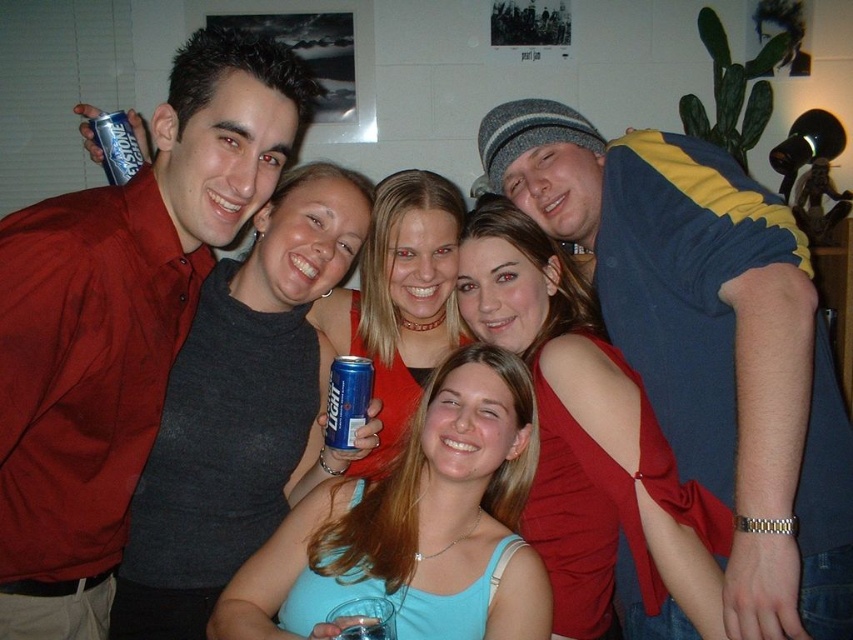
Question: Can you confirm if blue metallic can at center is smaller than blue metallic can at upper left?

Choices:
 (A) yes
 (B) no

Answer: (A)

Question: Does matte red shirt at left appear under blue metallic can at center?

Choices:
 (A) no
 (B) yes

Answer: (A)

Question: Which object is the closest to the matte red shirt at left?

Choices:
 (A) blue and yellow striped shirt at upper right
 (B) matte red dress at center

Answer: (B)

Question: Which of the following is the farthest from the observer?

Choices:
 (A) (480, 481)
 (B) (112, 147)

Answer: (B)

Question: Which of the following is the farthest from the observer?

Choices:
 (A) (347, 428)
 (B) (440, 182)
 (C) (323, 170)

Answer: (B)

Question: Where is matte gray tank top at center located in relation to matte blue tank top at center in the image?

Choices:
 (A) below
 (B) above

Answer: (B)